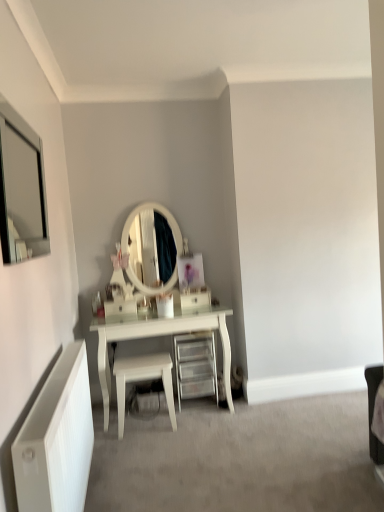
Question: Could you tell me if white glossy drawer at center is facing white glossy stool at center?

Choices:
 (A) yes
 (B) no

Answer: (B)

Question: Could white glossy stool at center be considered to be inside white glossy drawer at center?

Choices:
 (A) no
 (B) yes

Answer: (A)

Question: Is white glossy drawer at center further to camera compared to white glossy stool at center?

Choices:
 (A) yes
 (B) no

Answer: (A)

Question: Can you confirm if white glossy drawer at center is bigger than white glossy stool at center?

Choices:
 (A) no
 (B) yes

Answer: (A)

Question: Is white glossy drawer at center in contact with white glossy stool at center?

Choices:
 (A) yes
 (B) no

Answer: (B)

Question: Does point (23, 160) appear closer or farther from the camera than point (183, 300)?

Choices:
 (A) closer
 (B) farther

Answer: (A)

Question: From the image's perspective, is matte silver mirror at upper left above or below white glossy drawer at center?

Choices:
 (A) above
 (B) below

Answer: (A)

Question: Is matte silver mirror at upper left wider or thinner than white glossy drawer at center?

Choices:
 (A) wide
 (B) thin

Answer: (B)

Question: Would you say matte silver mirror at upper left is to the left or to the right of white glossy drawer at center in the picture?

Choices:
 (A) left
 (B) right

Answer: (A)

Question: Would you say matte silver mirror at upper left is inside or outside white glossy stool at center?

Choices:
 (A) inside
 (B) outside

Answer: (B)

Question: Is matte silver mirror at upper left wider or thinner than white glossy stool at center?

Choices:
 (A) thin
 (B) wide

Answer: (A)

Question: Considering the positions of point (29, 177) and point (127, 376), is point (29, 177) closer or farther from the camera than point (127, 376)?

Choices:
 (A) farther
 (B) closer

Answer: (A)

Question: From their relative heights in the image, would you say matte silver mirror at upper left is taller or shorter than white glossy stool at center?

Choices:
 (A) tall
 (B) short

Answer: (A)

Question: Would you say white glossy stool at center is inside or outside clear plastic drawer at center?

Choices:
 (A) inside
 (B) outside

Answer: (B)

Question: From a real-world perspective, is white glossy stool at center physically located above or below clear plastic drawer at center?

Choices:
 (A) above
 (B) below

Answer: (B)